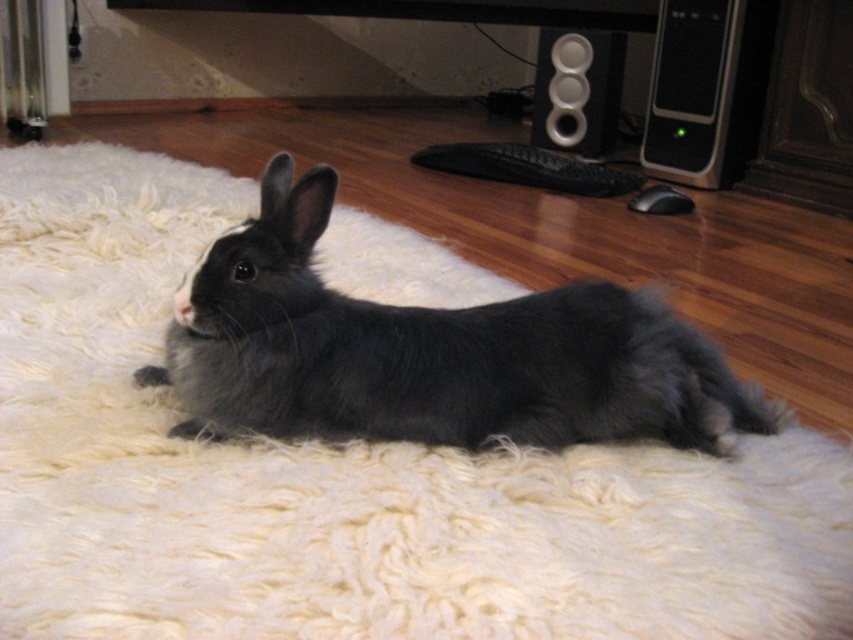
Question: Which of the following is the farthest from the observer?

Choices:
 (A) satin black speaker at center right
 (B) black plastic speaker at upper right
 (C) black soft fur rabbit at center

Answer: (B)

Question: Can you confirm if black soft fur rabbit at center is positioned to the left of satin black speaker at center right?

Choices:
 (A) no
 (B) yes

Answer: (B)

Question: Considering the relative positions of black soft fur rabbit at center and satin black speaker at center right in the image provided, where is black soft fur rabbit at center located with respect to satin black speaker at center right?

Choices:
 (A) right
 (B) left

Answer: (B)

Question: Which of the following is the farthest from the observer?

Choices:
 (A) (555, 29)
 (B) (712, 176)
 (C) (664, 433)

Answer: (A)

Question: Which of the following is the farthest from the observer?

Choices:
 (A) (672, 129)
 (B) (579, 340)

Answer: (A)

Question: Can you confirm if black soft fur rabbit at center is thinner than satin black speaker at center right?

Choices:
 (A) no
 (B) yes

Answer: (A)